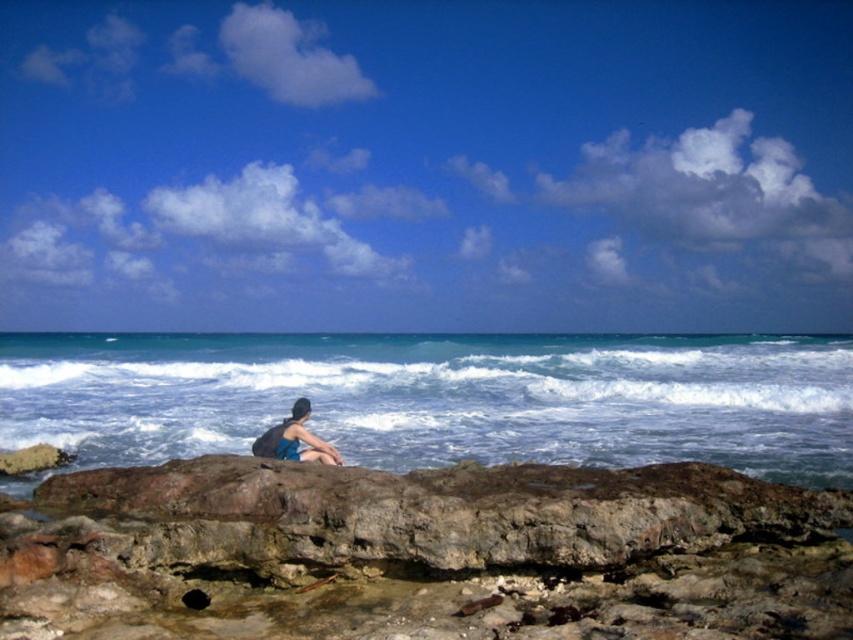
Question: Which point appears closest to the camera in this image?

Choices:
 (A) (444, 384)
 (B) (635, 486)

Answer: (B)

Question: Which of the following is the farthest from the observer?

Choices:
 (A) blue fabric shorts at center
 (B) rusty rock at lower center
 (C) blue water at center

Answer: (C)

Question: Is rusty rock at lower center to the left of blue fabric shorts at center from the viewer's perspective?

Choices:
 (A) no
 (B) yes

Answer: (A)

Question: Can you confirm if blue water at center is smaller than blue fabric shorts at center?

Choices:
 (A) yes
 (B) no

Answer: (B)

Question: Which point is farther to the camera?

Choices:
 (A) rusty rock at lower center
 (B) blue water at center
 (C) blue fabric shorts at center

Answer: (B)

Question: Can you confirm if rusty rock at lower center is thinner than blue fabric shorts at center?

Choices:
 (A) yes
 (B) no

Answer: (B)